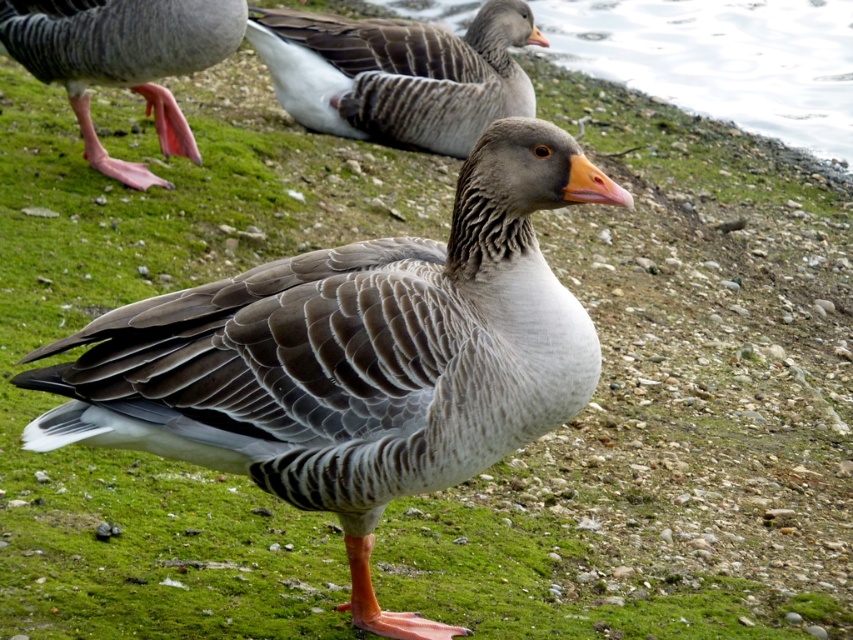
Question: Among these points, which one is nearest to the camera?

Choices:
 (A) (447, 317)
 (B) (196, 4)
 (C) (328, 88)

Answer: (A)

Question: Among these objects, which one is farthest from the camera?

Choices:
 (A) gray feathered goose at upper center
 (B) pink rubber feet at lower left
 (C) gray matte duck at center

Answer: (A)

Question: Does gray matte duck at center appear on the left side of pink rubber feet at lower left?

Choices:
 (A) no
 (B) yes

Answer: (A)

Question: Estimate the real-world distances between objects in this image. Which object is closer to the gray matte duck at center?

Choices:
 (A) gray feathered goose at upper center
 (B) pink rubber feet at lower left

Answer: (B)

Question: Can you confirm if gray matte duck at center is thinner than gray feathered goose at upper center?

Choices:
 (A) yes
 (B) no

Answer: (A)

Question: Is gray matte duck at center smaller than gray feathered goose at upper center?

Choices:
 (A) yes
 (B) no

Answer: (B)